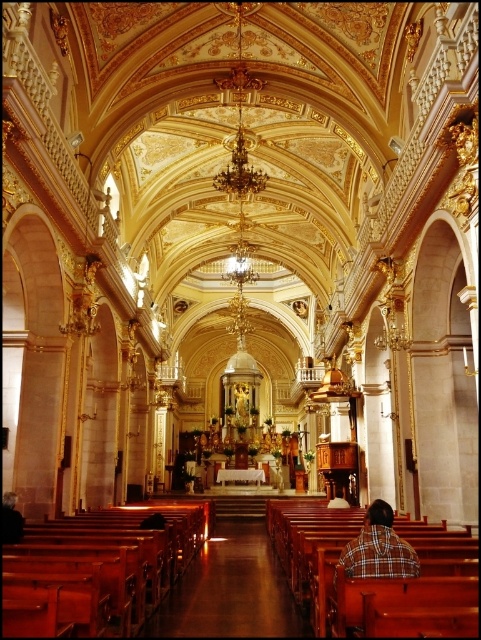
Question: Is plaid shirt at center below wooden bench at center?

Choices:
 (A) no
 (B) yes

Answer: (A)

Question: Among these objects, which one is nearest to the camera?

Choices:
 (A) wooden bench at center
 (B) plaid shirt at center

Answer: (B)

Question: Which point appears closest to the camera in this image?

Choices:
 (A) [353, 556]
 (B) [343, 496]

Answer: (A)

Question: Can you confirm if plaid shirt at center is positioned to the left of wooden bench at center?

Choices:
 (A) yes
 (B) no

Answer: (A)

Question: Does plaid shirt at center appear on the right side of wooden bench at center?

Choices:
 (A) no
 (B) yes

Answer: (A)

Question: Which point is farther to the camera?

Choices:
 (A) (340, 490)
 (B) (387, 541)

Answer: (A)